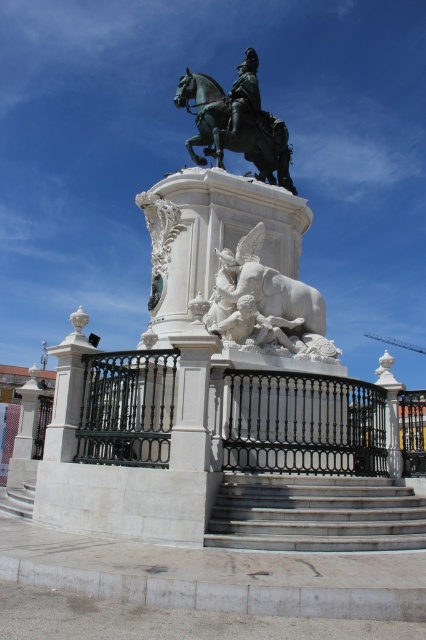
Question: Is white marble elephant at center positioned before green polished metal horse at upper center?

Choices:
 (A) yes
 (B) no

Answer: (A)

Question: Which is nearer to the white marble statue at center?

Choices:
 (A) white marble elephant at center
 (B) green polished metal horse at upper center

Answer: (A)

Question: Can you confirm if black wrought iron fence at lower center is positioned below white marble elephant at center?

Choices:
 (A) no
 (B) yes

Answer: (B)

Question: Based on their relative distances, which object is nearer to the white marble elephant at center?

Choices:
 (A) black wrought iron fence at lower center
 (B) white marble statue at center
 (C) green polished metal horse at upper center
 (D) gray stone stairs at center

Answer: (B)

Question: Does gray stone stairs at center appear on the right side of white marble elephant at center?

Choices:
 (A) yes
 (B) no

Answer: (A)

Question: Which of the following is the farthest from the observer?

Choices:
 (A) green polished metal horse at upper center
 (B) white marble statue at center
 (C) white marble elephant at center
 (D) black wrought iron fence at lower center

Answer: (A)